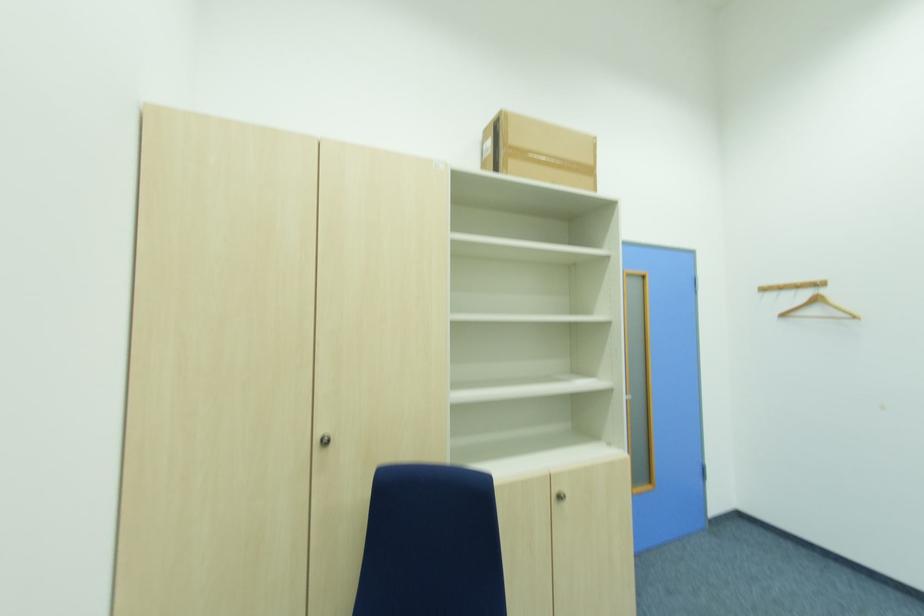
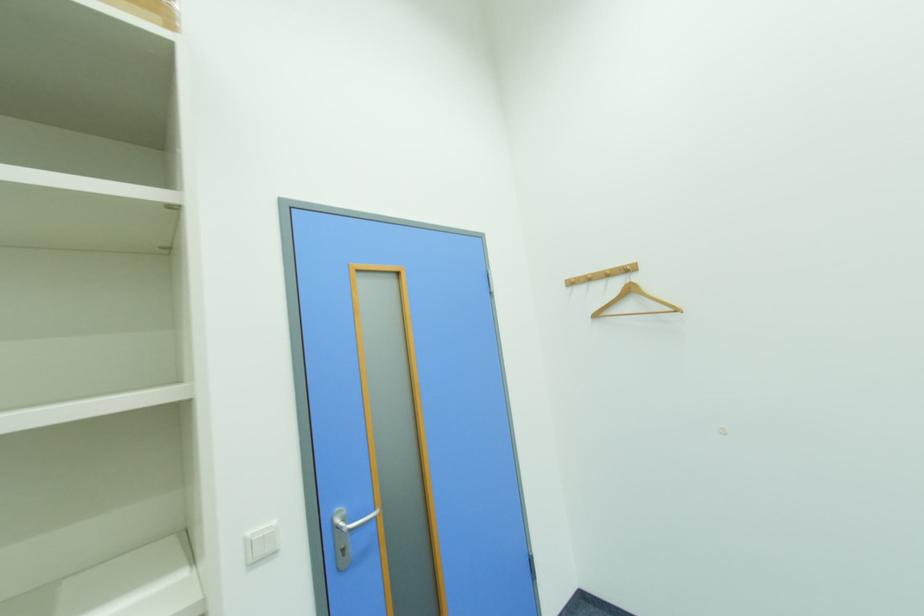
In a continuous first-person perspective shot, in which direction is the camera moving?

The movement direction of the cameraman is right, forward.